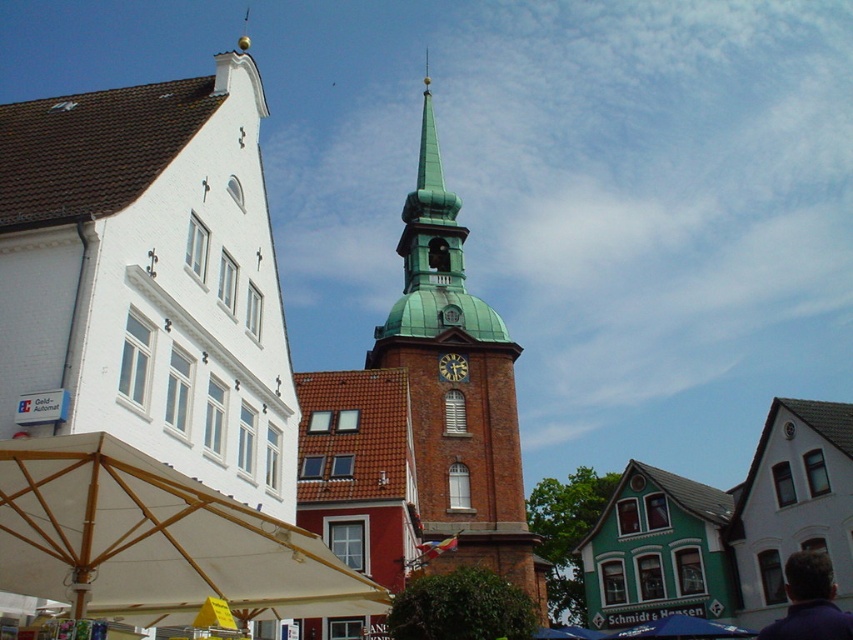
Question: Is green copper clock tower at center positioned behind purple fabric at lower right?

Choices:
 (A) yes
 (B) no

Answer: (A)

Question: Does green copper clock tower at center appear over blue fabric canopy at lower center?

Choices:
 (A) yes
 (B) no

Answer: (A)

Question: Which point is closer to the camera?

Choices:
 (A) dark brown wooden clock at center
 (B) white matte building at upper left

Answer: (B)

Question: Can you confirm if white fabric canopy at lower left is positioned below purple fabric at lower right?

Choices:
 (A) yes
 (B) no

Answer: (B)

Question: Which is nearer to the purple fabric at lower right?

Choices:
 (A) dark brown wooden clock at center
 (B) white fabric canopy at lower left
 (C) white matte building at upper left
 (D) green copper clock tower at center

Answer: (B)

Question: Which point is farther to the camera?

Choices:
 (A) (463, 376)
 (B) (7, 113)
 (C) (126, 516)

Answer: (A)